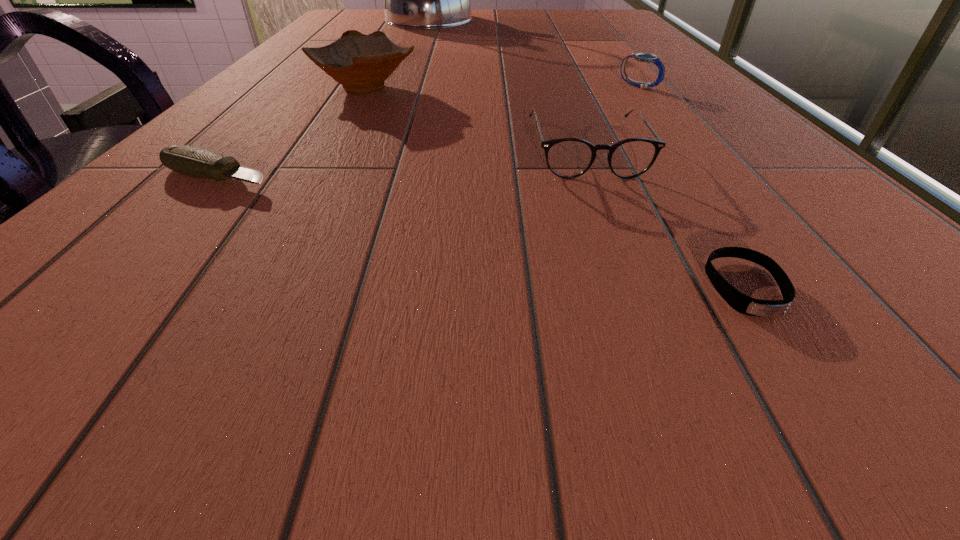
Locate an element on the screen. The width and height of the screenshot is (960, 540). free space between the watch and the spectacles is located at coordinates (612, 118).

Where is `vacant area that lies between the spectacles and the watch`? vacant area that lies between the spectacles and the watch is located at coordinates (612, 118).

The width and height of the screenshot is (960, 540). What are the coordinates of `empty location between the watch and the pottery` in the screenshot? It's located at (502, 87).

Where is `object that is the closest to the watch`? object that is the closest to the watch is located at coordinates (567, 158).

Image resolution: width=960 pixels, height=540 pixels. Find the location of `object that can be found as the fifth closest to the fifth shortest object`. object that can be found as the fifth closest to the fifth shortest object is located at coordinates (740, 302).